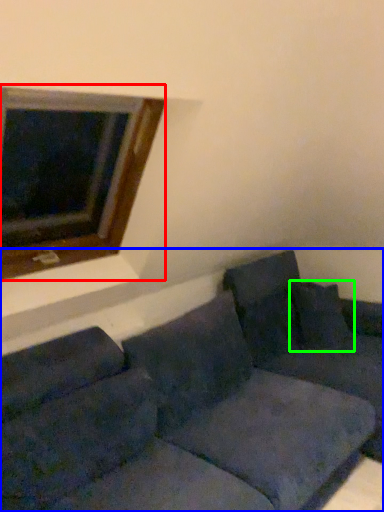
Question: Which object is the farthest from window (highlighted by a red box)? Choose among these: studio couch (highlighted by a blue box) or pillow (highlighted by a green box).

Choices:
 (A) studio couch
 (B) pillow

Answer: (B)